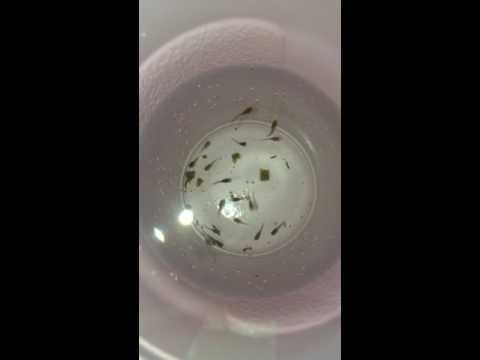
Locate an element on the screen. This screenshot has height=360, width=480. light shining on table is located at coordinates (144, 36).